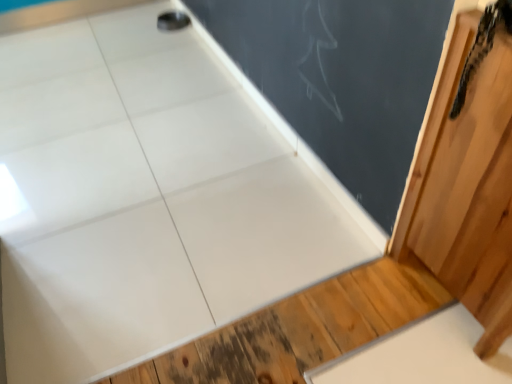
Describe the element at coordinates (468, 178) in the screenshot. I see `wooden barn door at right` at that location.

Where is `matte black chalkboard at upper center`? The image size is (512, 384). matte black chalkboard at upper center is located at coordinates (341, 79).

Considering the positions of points (490, 49) and (401, 70), is point (490, 49) farther from camera compared to point (401, 70)?

No, (490, 49) is closer to viewer.

Consider the image. Which of these two, black textured snake at upper right or matte black chalkboard at upper center, is bigger?

With larger size is black textured snake at upper right.

Does black textured snake at upper right lie in front of matte black chalkboard at upper center?

Yes, black textured snake at upper right is closer to the viewer.

Where is `barn door below the matte black chalkboard at upper center (from the image's perspective)`? The image size is (512, 384). barn door below the matte black chalkboard at upper center (from the image's perspective) is located at coordinates (468, 178).

Is wooden barn door at right not near matte black chalkboard at upper center?

wooden barn door at right is near matte black chalkboard at upper center, not far away.

Based on the photo, based on their sizes in the image, would you say wooden barn door at right is bigger or smaller than matte black chalkboard at upper center?

In the image, wooden barn door at right appears to be larger than matte black chalkboard at upper center.

Considering the sizes of objects black textured snake at upper right and wooden barn door at right in the image provided, who is smaller, black textured snake at upper right or wooden barn door at right?

black textured snake at upper right is smaller.

Considering the relative sizes of black textured snake at upper right and wooden barn door at right in the image provided, is black textured snake at upper right taller than wooden barn door at right?

No.

Where is `barn door that is below the black textured snake at upper right (from the image's perspective)`? barn door that is below the black textured snake at upper right (from the image's perspective) is located at coordinates (468, 178).

Is matte black chalkboard at upper center surrounding black textured snake at upper right?

That's incorrect, black textured snake at upper right is not inside matte black chalkboard at upper center.

Based on the photo, is matte black chalkboard at upper center to the left of black textured snake at upper right from the viewer's perspective?

Correct, you'll find matte black chalkboard at upper center to the left of black textured snake at upper right.

How different are the orientations of matte black chalkboard at upper center and black textured snake at upper right in degrees?

The angle between the facing direction of matte black chalkboard at upper center and the facing direction of black textured snake at upper right is 0.397 degrees.

Consider the image. Between matte black chalkboard at upper center and black textured snake at upper right, which one has smaller size?

matte black chalkboard at upper center is smaller.

Which object is more forward, wooden barn door at right or black textured snake at upper right?

Positioned in front is wooden barn door at right.

Does wooden barn door at right appear on the left side of black textured snake at upper right?

No, wooden barn door at right is not to the left of black textured snake at upper right.

Is wooden barn door at right taller than black textured snake at upper right?

Indeed, wooden barn door at right has a greater height compared to black textured snake at upper right.

How much distance is there between wooden barn door at right and black textured snake at upper right?

wooden barn door at right is 7.78 inches from black textured snake at upper right.

Does matte black chalkboard at upper center have a larger size compared to wooden barn door at right?

No, matte black chalkboard at upper center is not bigger than wooden barn door at right.

Does point (434, 70) appear closer or farther from the camera than point (494, 23)?

Clearly, point (434, 70) is more distant from the camera than point (494, 23).

Considering the relative positions of matte black chalkboard at upper center and wooden barn door at right in the image provided, is matte black chalkboard at upper center behind wooden barn door at right?

Yes.

Is matte black chalkboard at upper center far away from wooden barn door at right?

matte black chalkboard at upper center is near wooden barn door at right, not far away.

The height and width of the screenshot is (384, 512). Identify the location of animal to the right of matte black chalkboard at upper center. (482, 46).

In order to click on bulletin board lying behind the wooden barn door at right in this screenshot , I will do `click(341, 79)`.

Which object lies further to the anchor point wooden barn door at right, matte black chalkboard at upper center or black textured snake at upper right?

matte black chalkboard at upper center is positioned further to the anchor wooden barn door at right.

When comparing their distances from black textured snake at upper right, does wooden barn door at right or matte black chalkboard at upper center seem further?

matte black chalkboard at upper center is further to black textured snake at upper right.

Estimate the real-world distances between objects in this image. Which object is further from matte black chalkboard at upper center, wooden barn door at right or black textured snake at upper right?

The object further to matte black chalkboard at upper center is black textured snake at upper right.

Estimate the real-world distances between objects in this image. Which object is closer to wooden barn door at right, black textured snake at upper right or matte black chalkboard at upper center?

black textured snake at upper right is positioned closer to the anchor wooden barn door at right.

Looking at the image, which one is located further to black textured snake at upper right, matte black chalkboard at upper center or wooden barn door at right?

matte black chalkboard at upper center is positioned further to the anchor black textured snake at upper right.

Considering their positions, is black textured snake at upper right positioned closer to matte black chalkboard at upper center than wooden barn door at right?

Based on the image, wooden barn door at right appears to be nearer to matte black chalkboard at upper center.

Locate an element on the screen. This screenshot has height=384, width=512. animal between wooden barn door at right and matte black chalkboard at upper center from front to back is located at coordinates (482, 46).